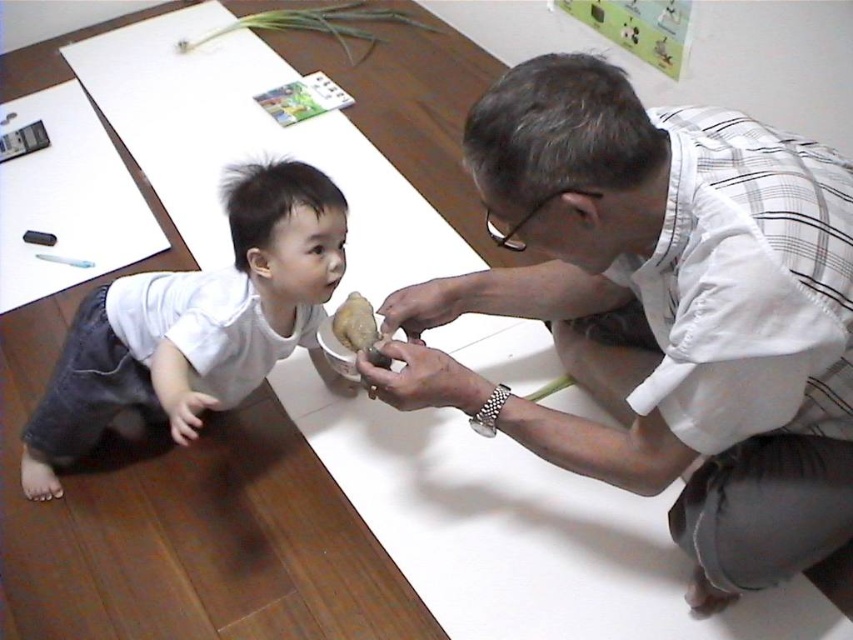
Who is taller, white checkered shirt at upper right or slightly translucent white food at center?

Standing taller between the two is white checkered shirt at upper right.

Is white checkered shirt at upper right below slightly translucent white food at center?

Correct, white checkered shirt at upper right is located below slightly translucent white food at center.

Does point (534, 83) come in front of point (355, 330)?

That is True.

What are the coordinates of `white checkered shirt at upper right` in the screenshot? It's located at (662, 310).

Does white matte shirt at lower left appear over slightly translucent white food at center?

No.

Identify the location of white matte shirt at lower left. (194, 323).

Find the location of `white matte shirt at lower left`. white matte shirt at lower left is located at coordinates (194, 323).

Between point (614, 438) and point (120, 410), which one is positioned in front?

Point (614, 438)

Locate an element on the screen. The width and height of the screenshot is (853, 640). white checkered shirt at upper right is located at coordinates (662, 310).